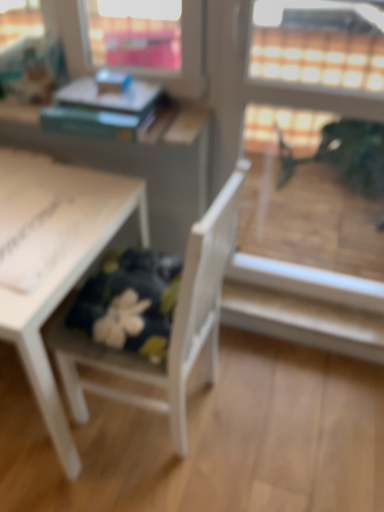
Question: Is transparent glass screen door at upper right not near white wood chair at lower left?

Choices:
 (A) no
 (B) yes

Answer: (A)

Question: Considering the relative sizes of transparent glass screen door at upper right and white wood chair at lower left in the image provided, is transparent glass screen door at upper right thinner than white wood chair at lower left?

Choices:
 (A) yes
 (B) no

Answer: (A)

Question: Can you confirm if transparent glass screen door at upper right is taller than white wood chair at lower left?

Choices:
 (A) no
 (B) yes

Answer: (B)

Question: Is transparent glass screen door at upper right wider than white wood chair at lower left?

Choices:
 (A) no
 (B) yes

Answer: (A)

Question: Considering the relative positions of transparent glass screen door at upper right and white wood chair at lower left in the image provided, is transparent glass screen door at upper right to the left of white wood chair at lower left from the viewer's perspective?

Choices:
 (A) no
 (B) yes

Answer: (A)

Question: Is white wood chair at lower left wider or thinner than hardcover book at upper left?

Choices:
 (A) thin
 (B) wide

Answer: (B)

Question: From a real-world perspective, is white wood chair at lower left positioned above or below hardcover book at upper left?

Choices:
 (A) below
 (B) above

Answer: (A)

Question: Which is correct: white wood chair at lower left is inside hardcover book at upper left, or outside of it?

Choices:
 (A) inside
 (B) outside

Answer: (B)

Question: From the image's perspective, is white wood chair at lower left positioned above or below hardcover book at upper left?

Choices:
 (A) above
 (B) below

Answer: (B)

Question: From a real-world perspective, is white matte table at lower left physically located above or below white wood chair at lower left?

Choices:
 (A) below
 (B) above

Answer: (A)

Question: In the image, is white matte table at lower left positioned in front of or behind white wood chair at lower left?

Choices:
 (A) front
 (B) behind

Answer: (B)

Question: From the image's perspective, is white matte table at lower left above or below white wood chair at lower left?

Choices:
 (A) below
 (B) above

Answer: (B)

Question: Considering the positions of white matte table at lower left and white wood chair at lower left in the image, is white matte table at lower left bigger or smaller than white wood chair at lower left?

Choices:
 (A) small
 (B) big

Answer: (B)

Question: Would you say white wood chair at lower left is inside or outside transparent glass screen door at upper right?

Choices:
 (A) outside
 (B) inside

Answer: (A)

Question: From the image's perspective, is white wood chair at lower left positioned above or below transparent glass screen door at upper right?

Choices:
 (A) below
 (B) above

Answer: (A)